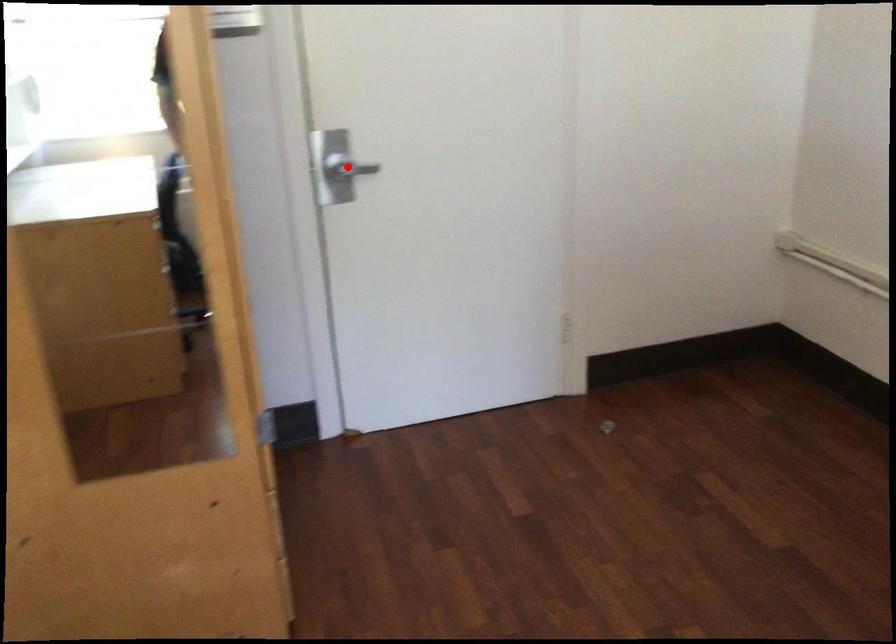
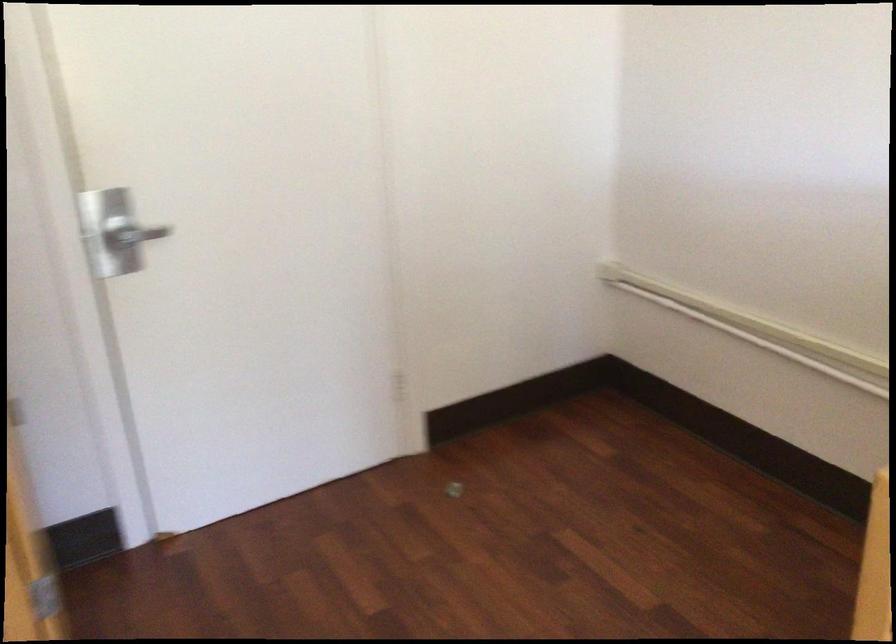
Where in the second image is the point corresponding to the highlighted location from the first image?

(133, 234)